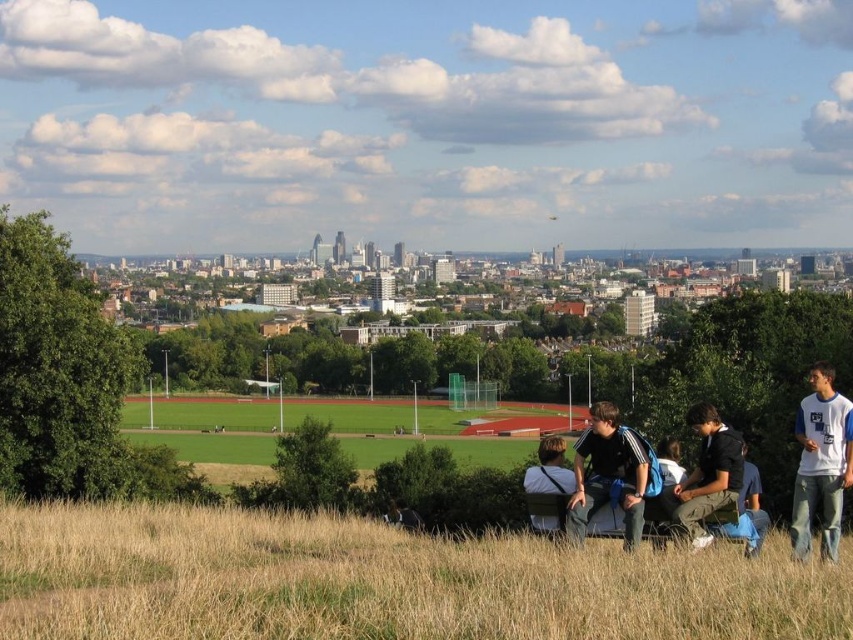
Question: Is dry grass at lower center smaller than white cotton shirt at right?

Choices:
 (A) no
 (B) yes

Answer: (A)

Question: Is dry grass at lower center further to camera compared to white cotton shirt at right?

Choices:
 (A) yes
 (B) no

Answer: (B)

Question: Which point is farther to the camera?

Choices:
 (A) click(799, 525)
 (B) click(561, 586)

Answer: (A)

Question: Estimate the real-world distances between objects in this image. Which object is farther from the dark blue jeans at lower right?

Choices:
 (A) dry grass at lower center
 (B) white cotton shirt at right

Answer: (A)

Question: Is dry grass at lower center below white cotton shirt at right?

Choices:
 (A) no
 (B) yes

Answer: (B)

Question: Which object is farther from the camera taking this photo?

Choices:
 (A) dark blue jeans at lower right
 (B) dry grass at lower center
 (C) white cotton shirt at right

Answer: (A)